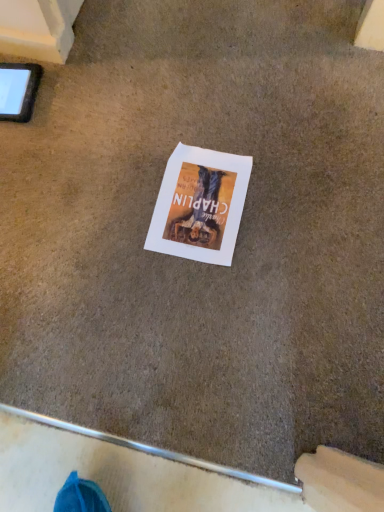
Locate an element on the screen. free spot to the left of white paper at center is located at coordinates (103, 207).